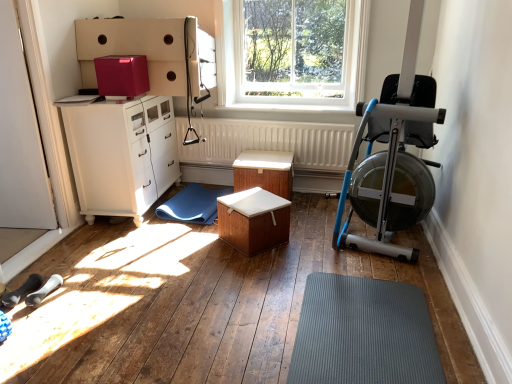
Image resolution: width=512 pixels, height=384 pixels. Identify the location of vacant area on the back side of gray rubber mat at lower center, arranged as the second doormat when viewed from the back. pos(332,262).